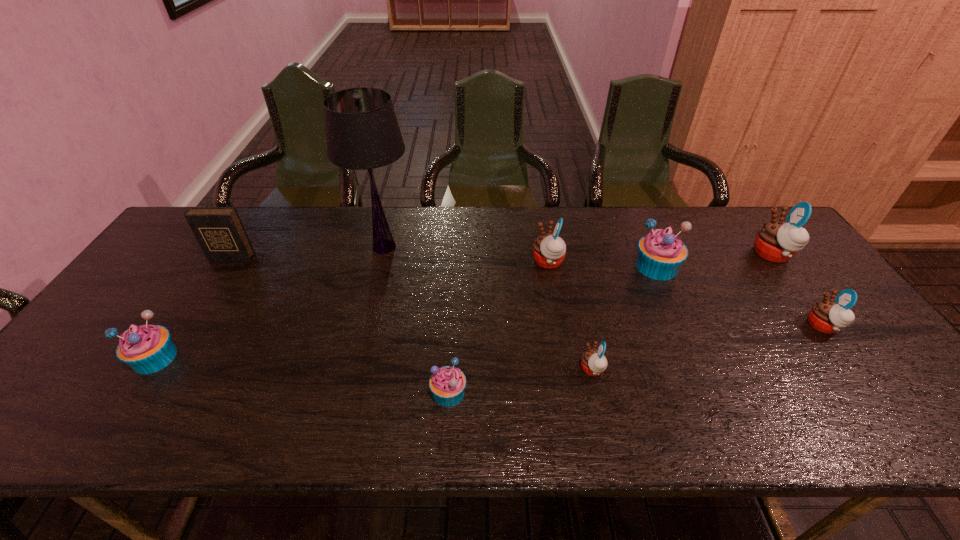
In order to click on vacant space located on the right of the second blue muffin from right to left in this screenshot , I will do `click(578, 393)`.

Where is `lampshade that is at the far edge`? This screenshot has height=540, width=960. lampshade that is at the far edge is located at coordinates (362, 132).

This screenshot has width=960, height=540. Identify the location of object present at the near edge. (447, 384).

Find the location of a particular element. The width and height of the screenshot is (960, 540). diary situated at the left edge is located at coordinates (219, 231).

The width and height of the screenshot is (960, 540). I want to click on muffin located at the left edge, so click(147, 349).

Find the location of a particular element. This screenshot has width=960, height=540. object present at the far right corner is located at coordinates (777, 241).

I want to click on blank space at the far edge of the desktop, so click(x=490, y=231).

In the image, there is a desktop. Where is `vacant region at the near edge`? The height and width of the screenshot is (540, 960). vacant region at the near edge is located at coordinates (684, 415).

The width and height of the screenshot is (960, 540). Identify the location of vacant space at the left edge. (146, 303).

Identify the location of vacant area at the right edge of the desktop. The height and width of the screenshot is (540, 960). (791, 304).